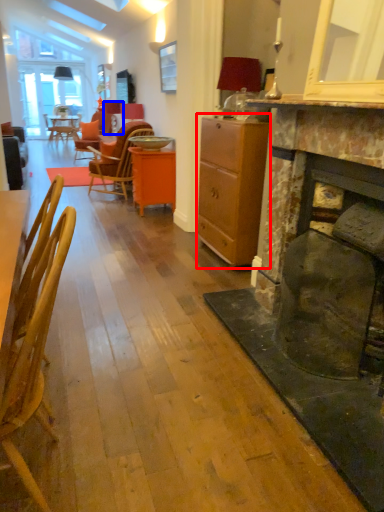
Question: Which object appears farthest to the camera in this image, cabinetry (highlighted by a red box) or lamp (highlighted by a blue box)?

Choices:
 (A) cabinetry
 (B) lamp

Answer: (B)